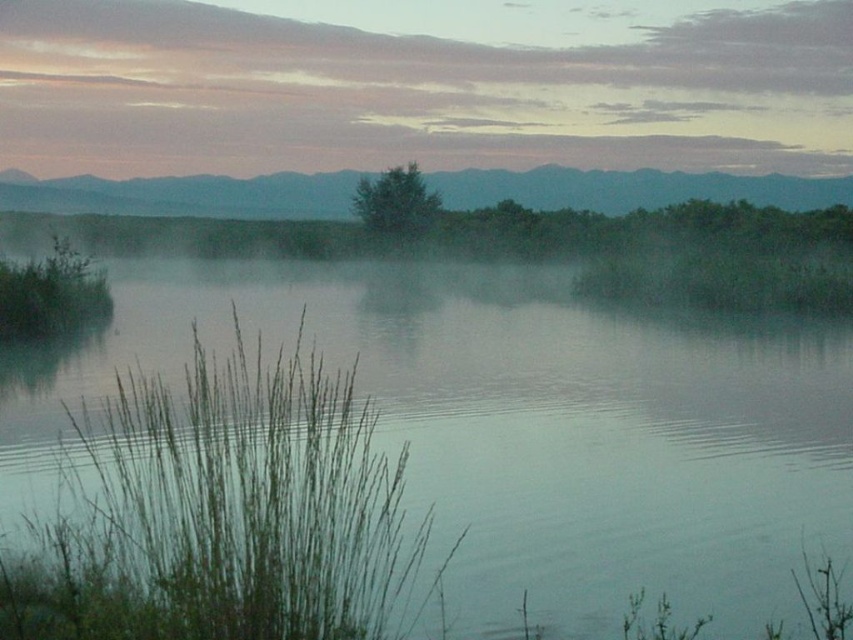
Question: Is green grassy river at center positioned before green grass at left?

Choices:
 (A) no
 (B) yes

Answer: (A)

Question: Which of the following is the farthest from the observer?

Choices:
 (A) green matte tree at center
 (B) green grassy river at center
 (C) green grass at left

Answer: (A)

Question: Among these objects, which one is nearest to the camera?

Choices:
 (A) green grassy river at center
 (B) green grass at left
 (C) green matte tree at center

Answer: (B)

Question: Does green grassy river at center come behind green matte tree at center?

Choices:
 (A) yes
 (B) no

Answer: (B)

Question: Which object is the farthest from the pastel sky clouds at upper center?

Choices:
 (A) green grassy river at center
 (B) green grass at left

Answer: (B)

Question: Is green grassy river at center wider than green grass at left?

Choices:
 (A) yes
 (B) no

Answer: (A)